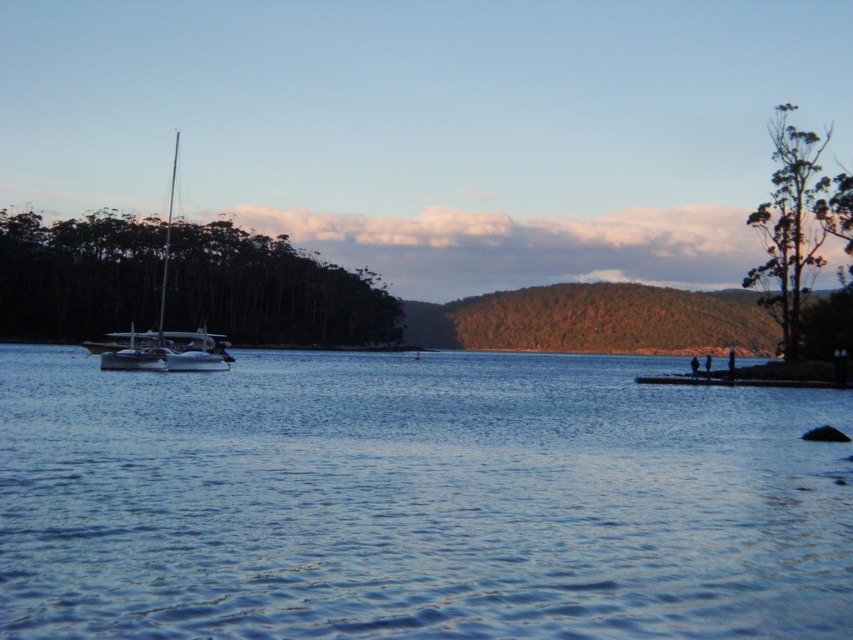
Locate an element on the screen. blue water at center is located at coordinates (416, 499).

Between point (39, 433) and point (163, 308), which one is positioned behind?

Positioned behind is point (163, 308).

Is point (166, 458) positioned before point (192, 364)?

Yes, it is.

Where is `blue water at center`? This screenshot has width=853, height=640. blue water at center is located at coordinates pyautogui.click(x=416, y=499).

Can you confirm if blue water at center is positioned to the left of green matte tree at left?

Incorrect, blue water at center is not on the left side of green matte tree at left.

Can you confirm if blue water at center is positioned below green matte tree at left?

Yes, blue water at center is below green matte tree at left.

Measure the distance between point (648,593) and camera.

Point (648,593) and camera are 10.41 meters apart from each other.

You are a GUI agent. You are given a task and a screenshot of the screen. Output one action in this format:
    pyautogui.click(x=<x>, y=<y>)
    Task: Click on the blue water at center
    This screenshot has height=640, width=853.
    Given the screenshot: What is the action you would take?
    pyautogui.click(x=416, y=499)

Is green matte tree at left below white glossy sailboat at left?

Indeed, green matte tree at left is positioned under white glossy sailboat at left.

Is green matte tree at left positioned in front of white glossy sailboat at left?

No, green matte tree at left is behind white glossy sailboat at left.

Identify the location of green matte tree at left. This screenshot has width=853, height=640. (271, 291).